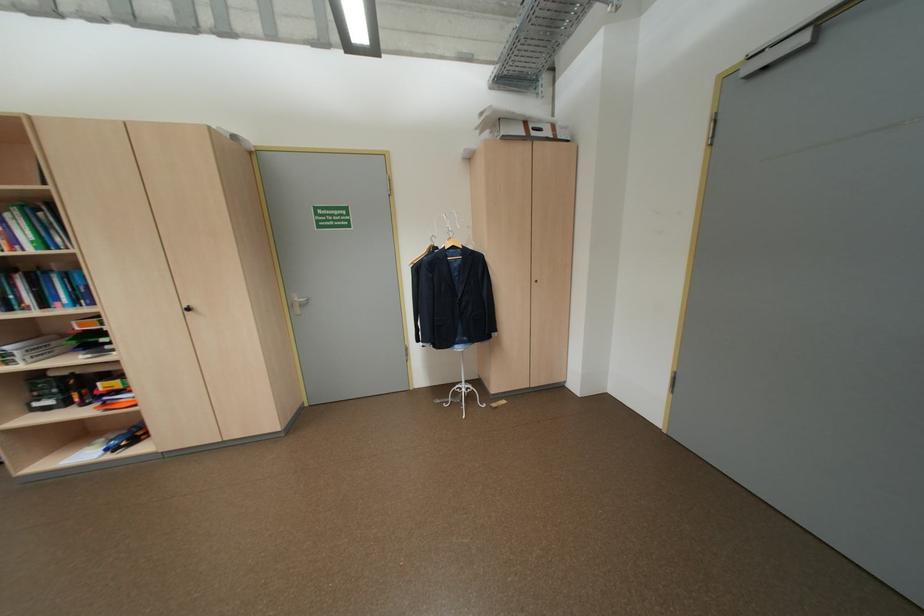
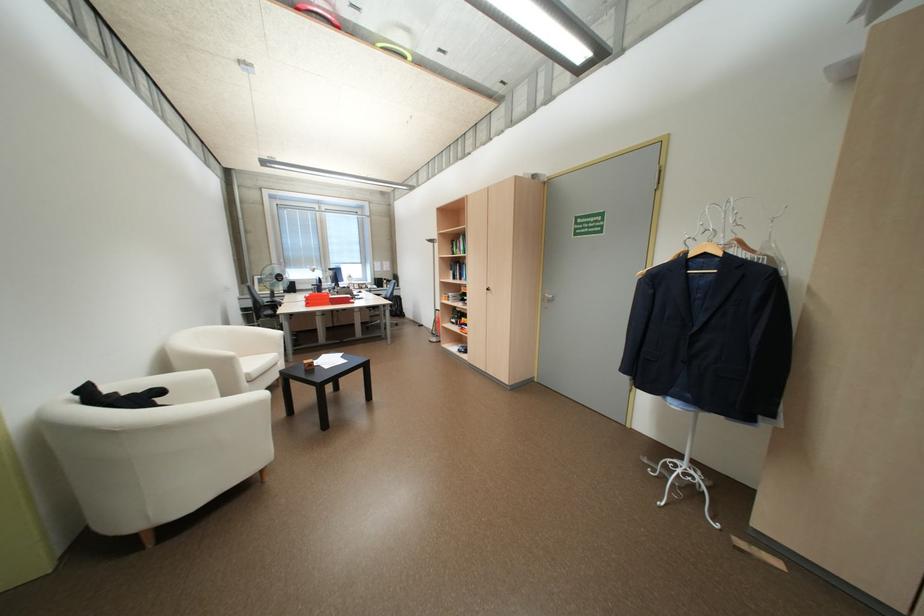
The point at (300,305) is marked in the first image. Where is the corresponding point in the second image?

(553, 299)